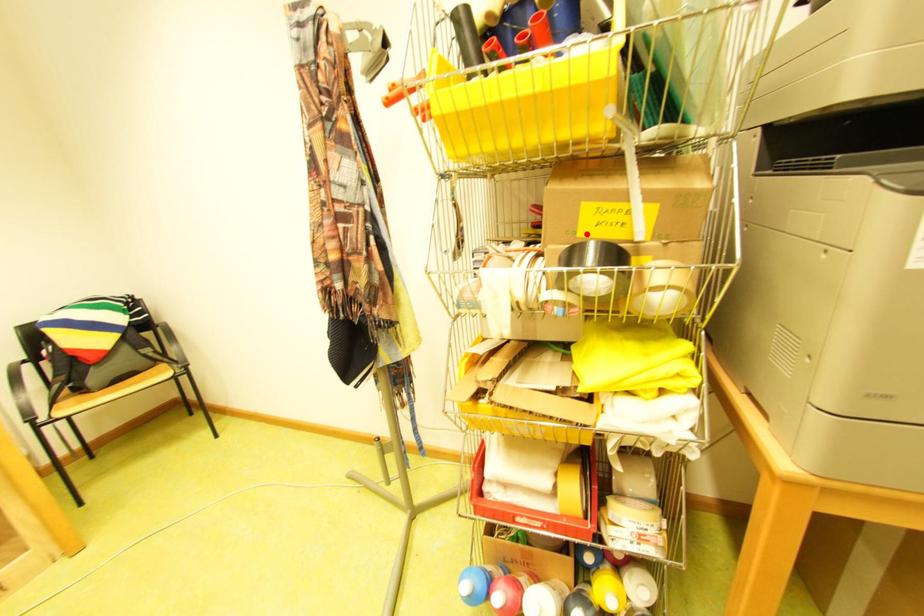
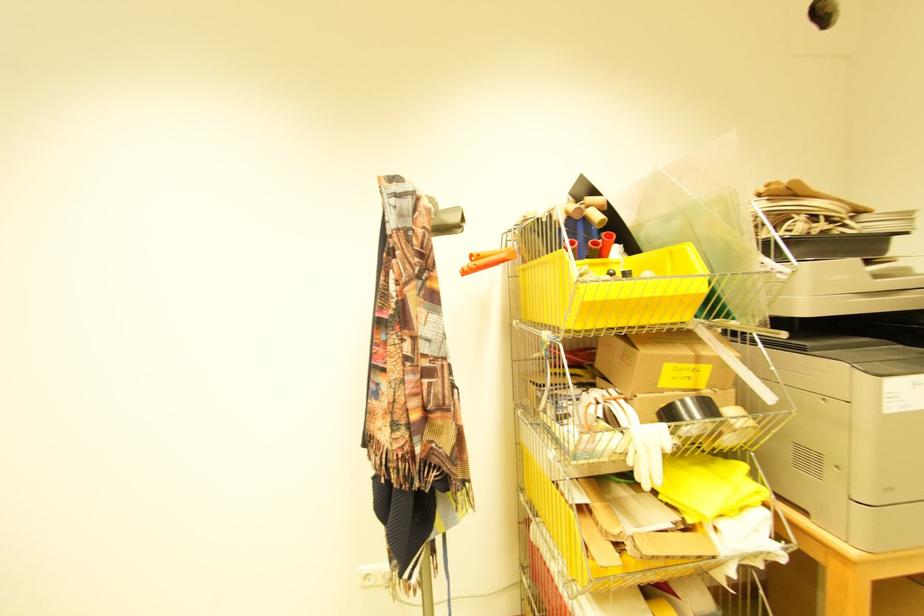
Question: I am providing you with two images of the same scene from different viewpoints. A red point is marked on the first image. Is the red point's position out of view in image 2?

Choices:
 (A) Yes
 (B) No

Answer: (B)